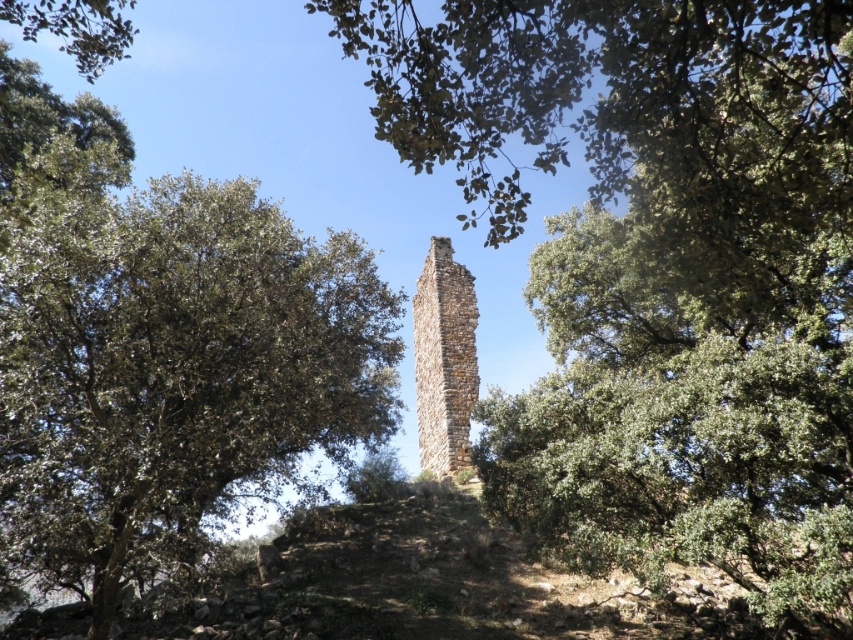
You are a bird looking for a perch. You see the green leafy tree at left and the brown stone chimney at center. Which one is taller?

The green leafy tree at left is taller than the brown stone chimney at center.

You are a bird flying over the ancient stone tower. You want to land on the green leafy tree at left first before moving to the brown stone chimney at center. Is the tree above the chimney in a position that allows this flight path?

The green leafy tree at left is located above the brown stone chimney at center, so yes, the tree is positioned above the chimney, allowing the bird to land on the tree first before moving down to the chimney.